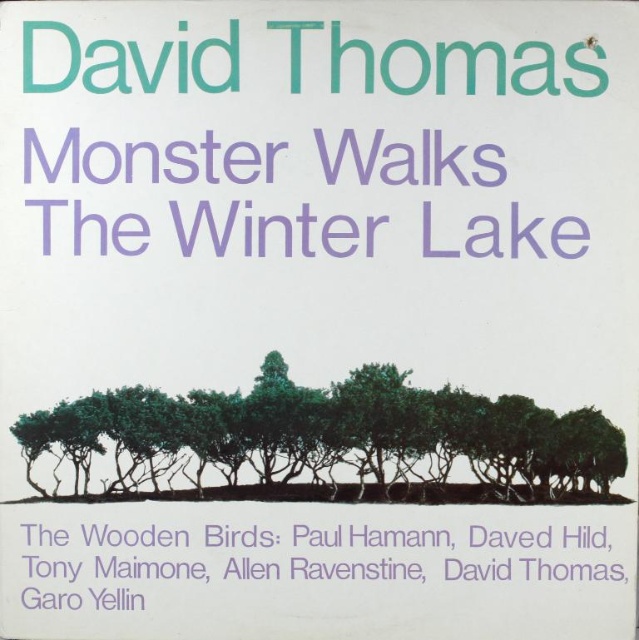
Which is more to the right, green matte trees at center or purple paper text at upper center?

green matte trees at center

The image size is (639, 640). Find the location of `green matte trees at center`. green matte trees at center is located at coordinates (320, 444).

Is point (220, 413) positioned behind point (456, 253)?

That is True.

Image resolution: width=639 pixels, height=640 pixels. Identify the location of green matte trees at center. (320, 444).

Is point (596, 452) farther from camera compared to point (335, 538)?

No.

Between point (316, 428) and point (548, 538), which one is positioned behind?

The point (316, 428) is more distant.

You are a GUI agent. You are given a task and a screenshot of the screen. Output one action in this format:
    pyautogui.click(x=<x>, y=<y>)
    Task: Click on the green matte trees at center
    
    Given the screenshot: What is the action you would take?
    pyautogui.click(x=320, y=444)

Can you confirm if purple paper text at upper center is thinner than purple paper at bottom?

Yes.

Is purple paper text at upper center above purple paper at bottom?

Correct, purple paper text at upper center is located above purple paper at bottom.

This screenshot has width=639, height=640. Describe the element at coordinates (148, 161) in the screenshot. I see `purple paper text at upper center` at that location.

Find the location of a particular element. purple paper text at upper center is located at coordinates (148, 161).